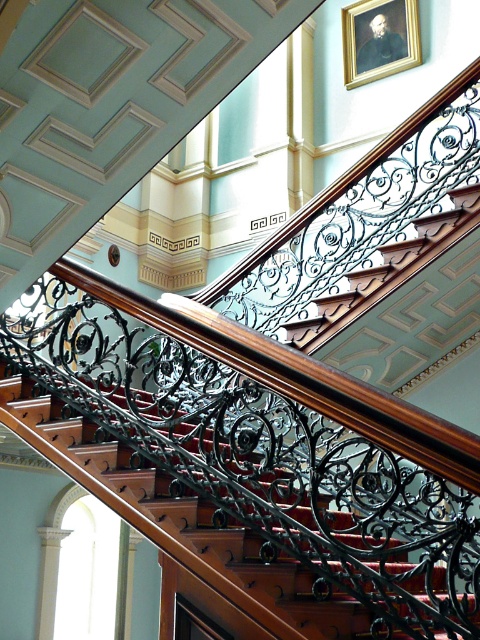
You are a painter who needs to paint the staircase. Your ladder can extend up to 8 feet. Based on the scene, can you safely reach the polished wood stairs at center with your ladder?

The polished wood stairs at center are 8.21 feet away from the viewer, which is slightly beyond the ladder extension limit of 8 feet. Therefore, the ladder may not be sufficient to safely reach the stairs.

You are an art curator planning to move a large sculpture into the space. The sculpture is 1.2 meters wide and needs to be placed between the polished wood stairs at center and the oil painting portrait at upper center. Based on their positions, can the sculpture fit in that space?

The polished wood stairs at center is positioned on the left side of oil painting portrait at upper center, so there is space between them. Since the sculpture is 1.2 meters wide and the distance between the stairs and the portrait is not specified, it is uncertain if it will fit. More information about the distance between them is needed.